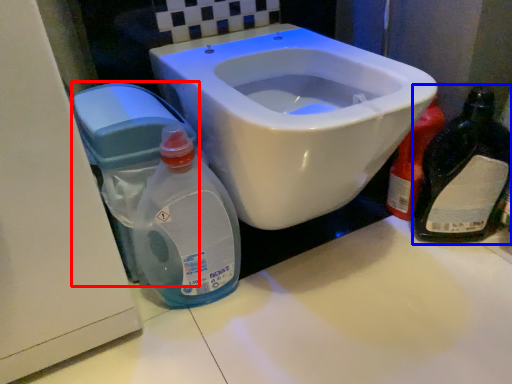
Question: Among these objects, which one is farthest to the camera, water tank (highlighted by a red box) or bottle (highlighted by a blue box)?

Choices:
 (A) water tank
 (B) bottle

Answer: (B)